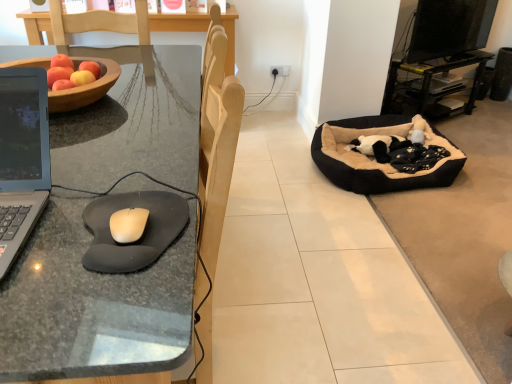
This screenshot has height=384, width=512. I want to click on free spot to the right of silver metallic laptop at left, so click(77, 239).